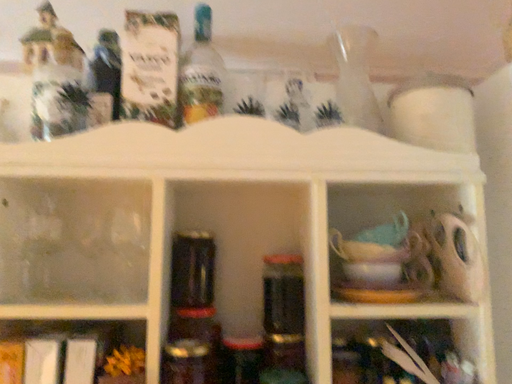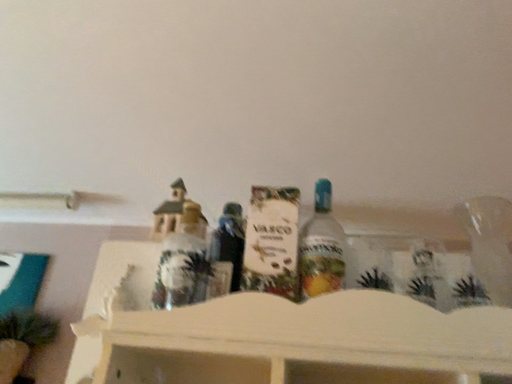
Question: Which way did the camera rotate in the video?

Choices:
 (A) rotated downward
 (B) rotated upward

Answer: (B)